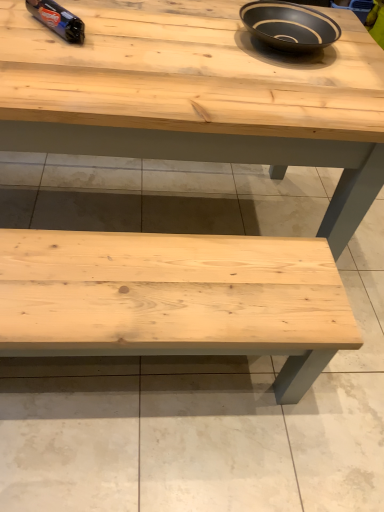
Identify the location of empty space that is to the right of shiny blue plastic bottle at upper left. This screenshot has width=384, height=512. (122, 36).